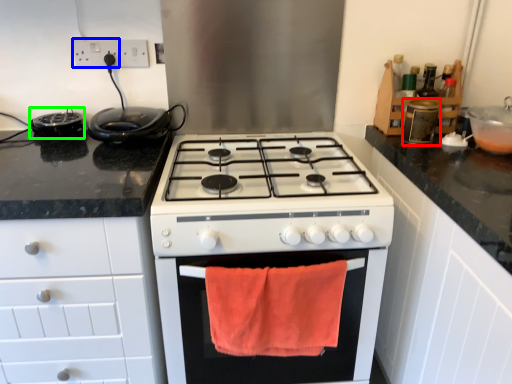
Question: Based on their relative distances, which object is farther from appliance (highlighted by a red box)? Choose from electric outlet (highlighted by a blue box) and appliance (highlighted by a green box).

Choices:
 (A) electric outlet
 (B) appliance

Answer: (B)